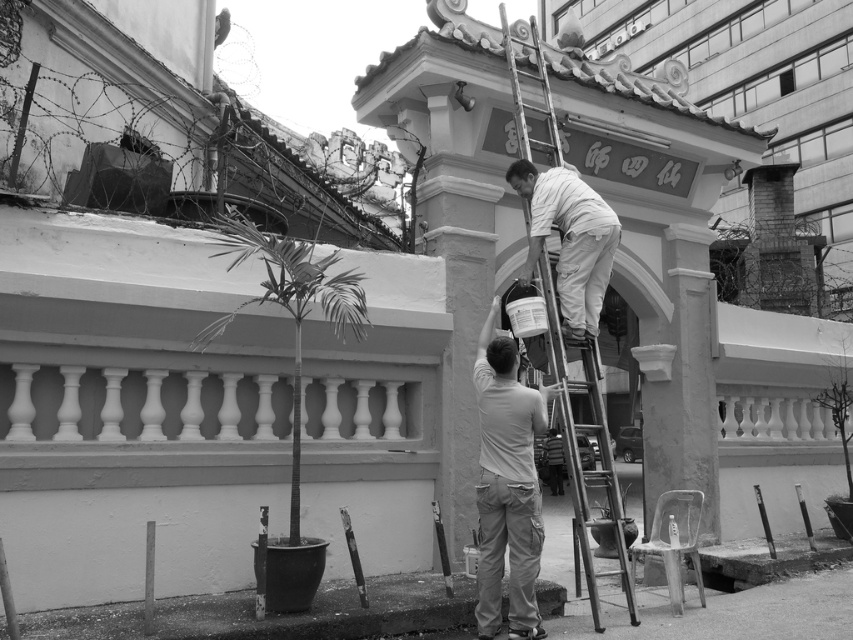
You are a safety inspector reviewing this maintenance work scene. You notice the light gray cotton shirt at center and the metallic silver ladder at center. Which object takes up more visual space in the image?

The light gray cotton shirt at center is larger in size than the metallic silver ladder at center, so it takes up more visual space in the image.

You are a worker observing the scene. There is a light gray cotton shirt at center and a white matte paint canister at upper center. Which object is positioned more to the right?

The white matte paint canister at upper center is positioned more to the right than the light gray cotton shirt at center.

You are a worker trying to reach the decorative elements at the top of the archway. You see the metallic silver ladder at center and the white matte paint canister at upper center. Which object is positioned higher in the image?

The white matte paint canister at upper center is positioned higher in the image than the metallic silver ladder at center.